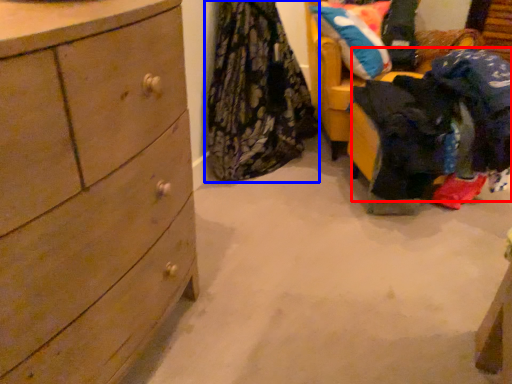
Question: Which of the following is the farthest to the observer, clothing (highlighted by a red box) or clothing (highlighted by a blue box)?

Choices:
 (A) clothing
 (B) clothing

Answer: (B)